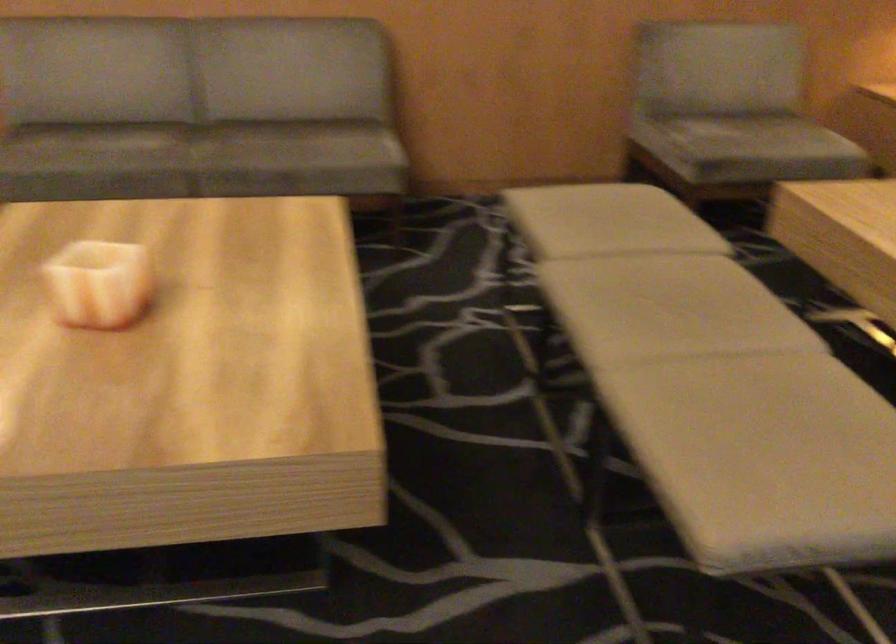
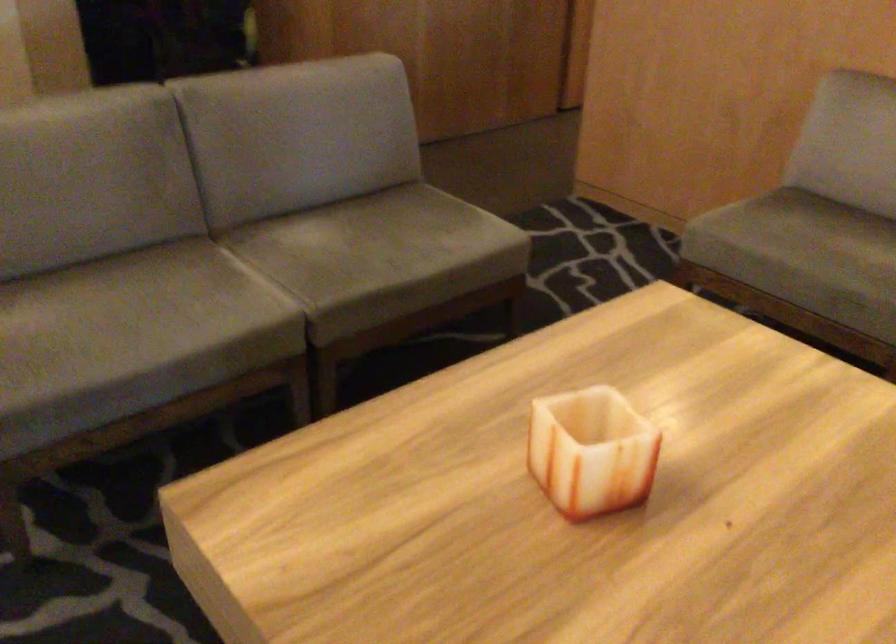
Question: The first image is from the beginning of the video and the second image is from the end. How did the camera likely rotate when shooting the video?

Choices:
 (A) Left
 (B) Right
 (C) Up
 (D) Down

Answer: (A)